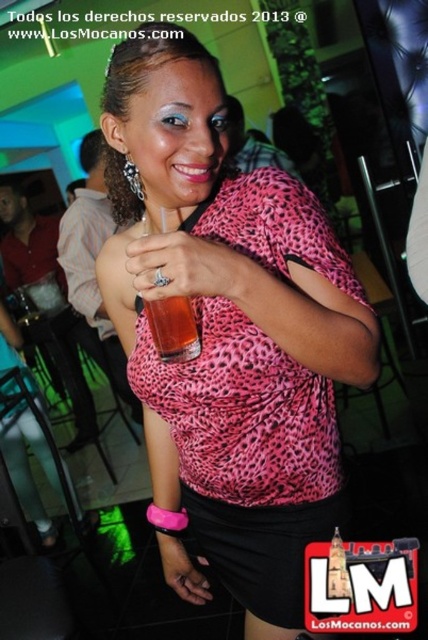
Question: Can you confirm if pink leopard print blouse at center is positioned to the left of translucent plastic cup at center?

Choices:
 (A) no
 (B) yes

Answer: (A)

Question: Which point is closer to the camera?

Choices:
 (A) translucent plastic cup at center
 (B) pink leopard print blouse at center

Answer: (B)

Question: Can you confirm if pink leopard print blouse at center is positioned to the right of translucent plastic cup at center?

Choices:
 (A) no
 (B) yes

Answer: (B)

Question: Does pink leopard print blouse at center have a greater width compared to translucent plastic cup at center?

Choices:
 (A) yes
 (B) no

Answer: (A)